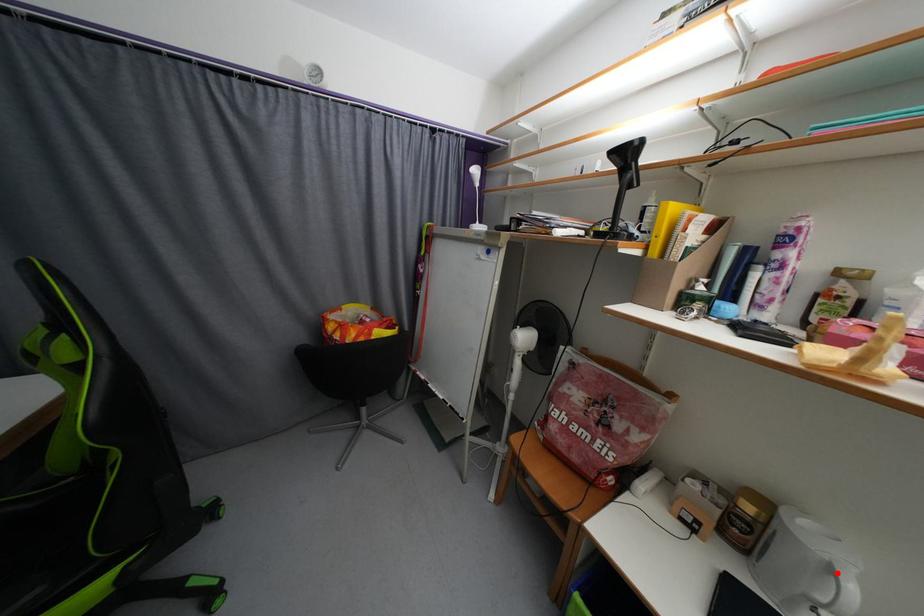
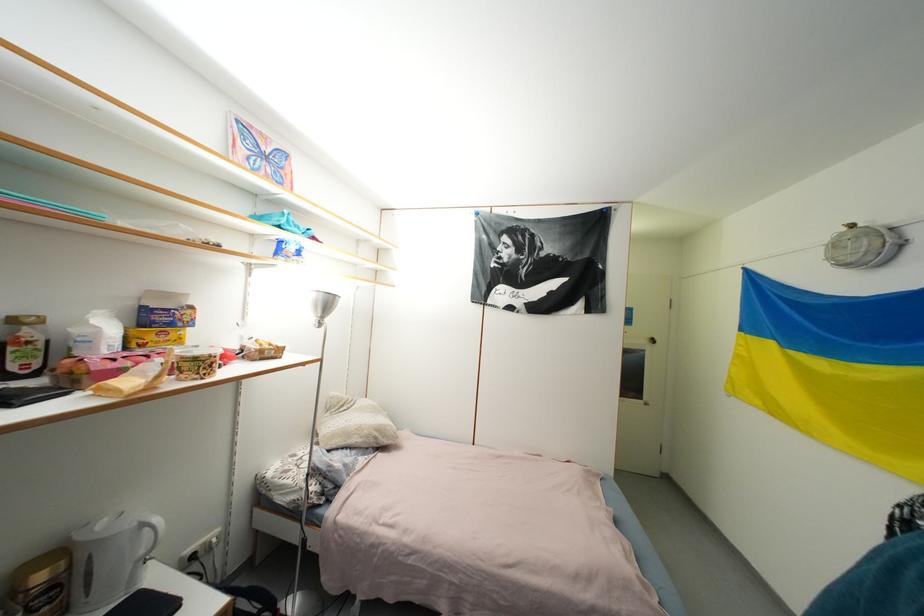
Find the pixel in the second image that matches the highlighted location in the first image.

(149, 528)